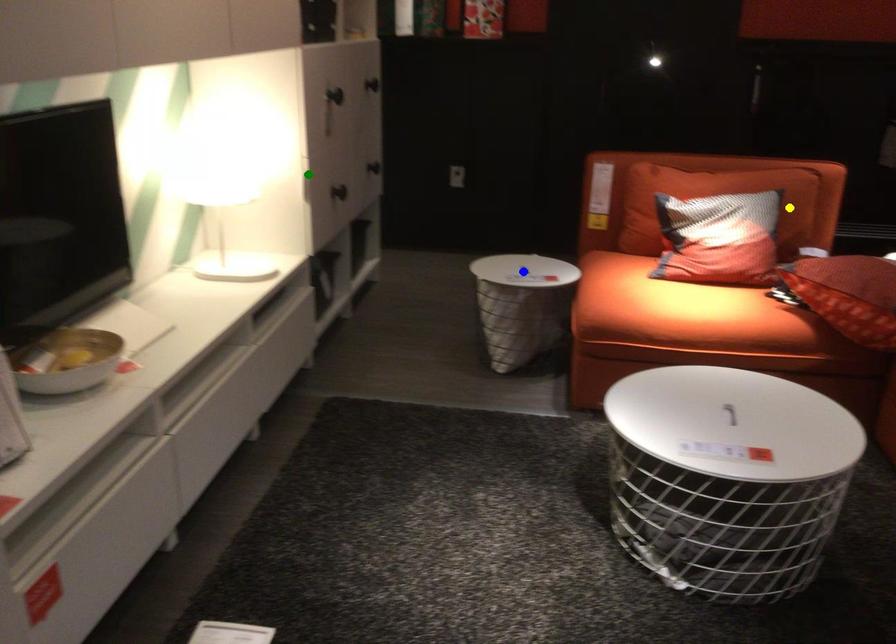
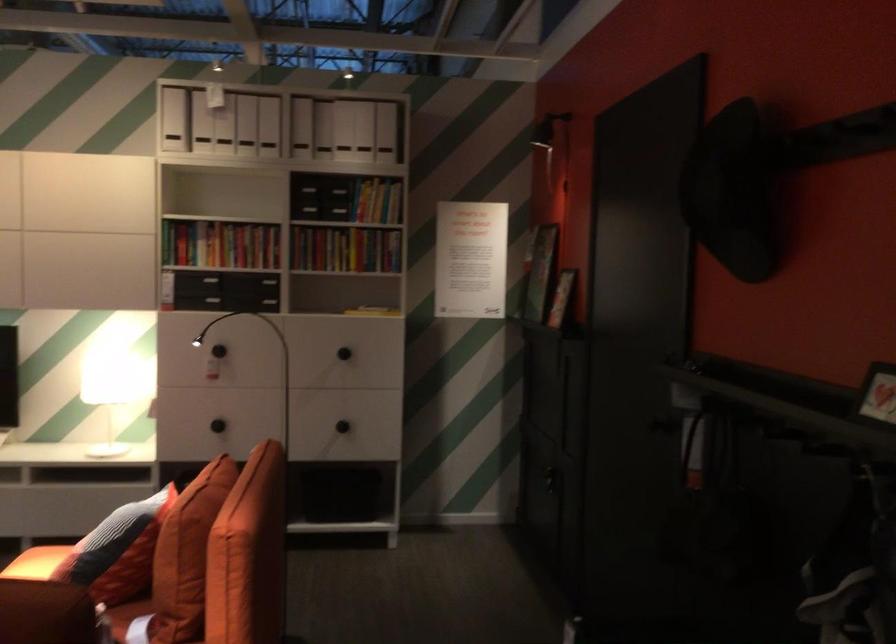
I am providing you with two images of the same scene from different viewpoints. Three points are marked in image1. Which point corresponds to a part or object that is occluded in image2?In image1, three points are marked. Which of them correspond to a part or object that is occluded in image2?Among the three points shown in image1, which one corresponds to a part or object that is no longer visible due to occlusion in image2?

blue point cannot be seen in image2.